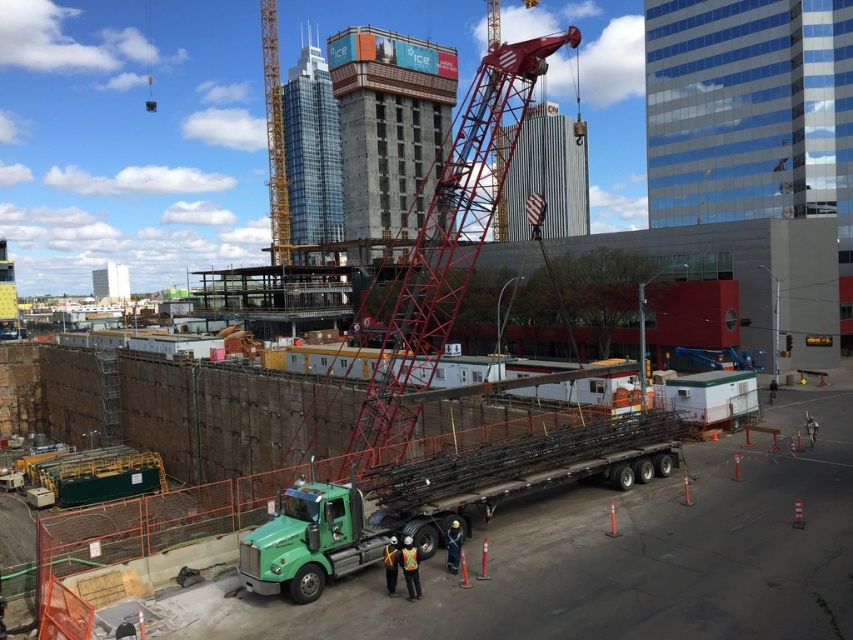
You are a safety inspector checking the construction site. You notice the green metallic trailer truck at center and the reflective orange vest at lower center. Which object would appear larger in the image?

The green metallic trailer truck at center is bigger than the reflective orange vest at lower center, so it would appear larger in the image.